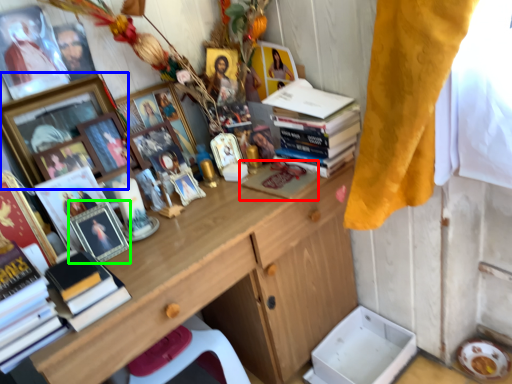
Question: Which object is the farthest from magazine (highlighted by a red box)? Choose among these: picture frame (highlighted by a blue box) or picture frame (highlighted by a green box).

Choices:
 (A) picture frame
 (B) picture frame

Answer: (A)